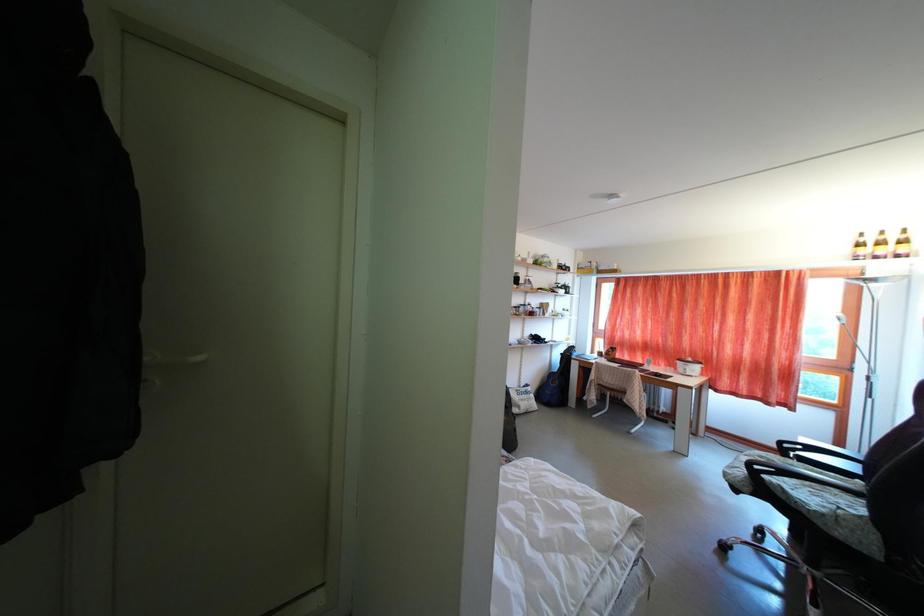
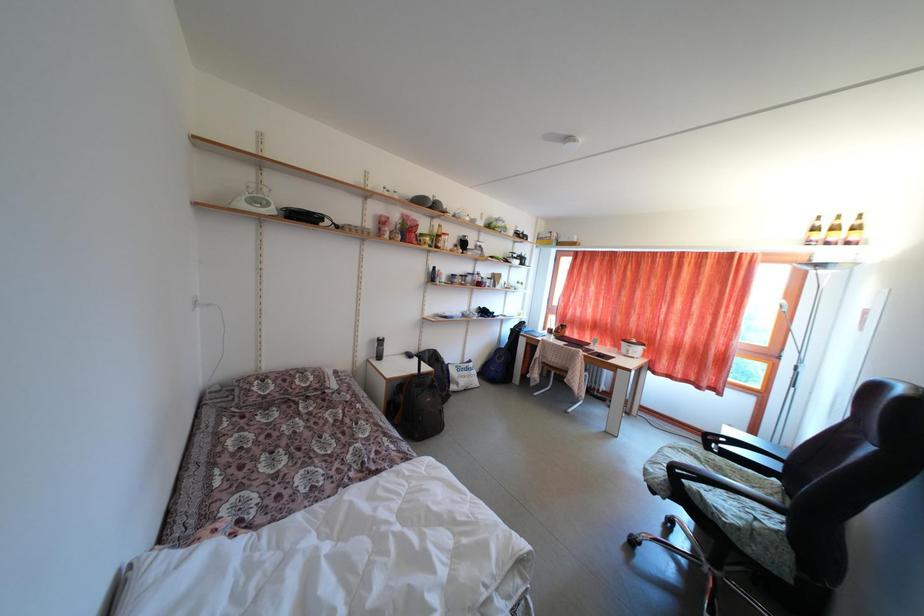
Question: Based on the continuous images, in which direction is the camera rotating? Reply with the corresponding letter.

Choices:
 (A) Left
 (B) Right
 (C) Up
 (D) Down

Answer: (D)